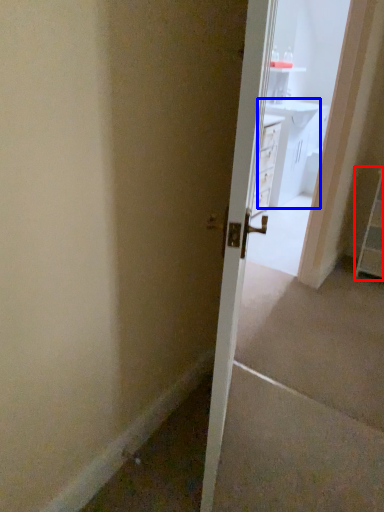
Question: Among these objects, which one is nearest to the camera, dresser (highlighted by a red box) or vanity (highlighted by a blue box)?

Choices:
 (A) dresser
 (B) vanity

Answer: (A)